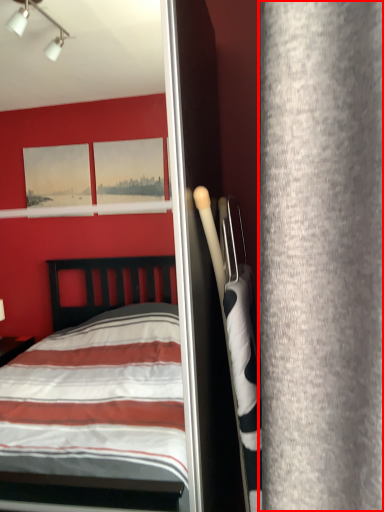
Question: In this image, where is curtain (annotated by the red box) located relative to screen door?

Choices:
 (A) left
 (B) right

Answer: (B)